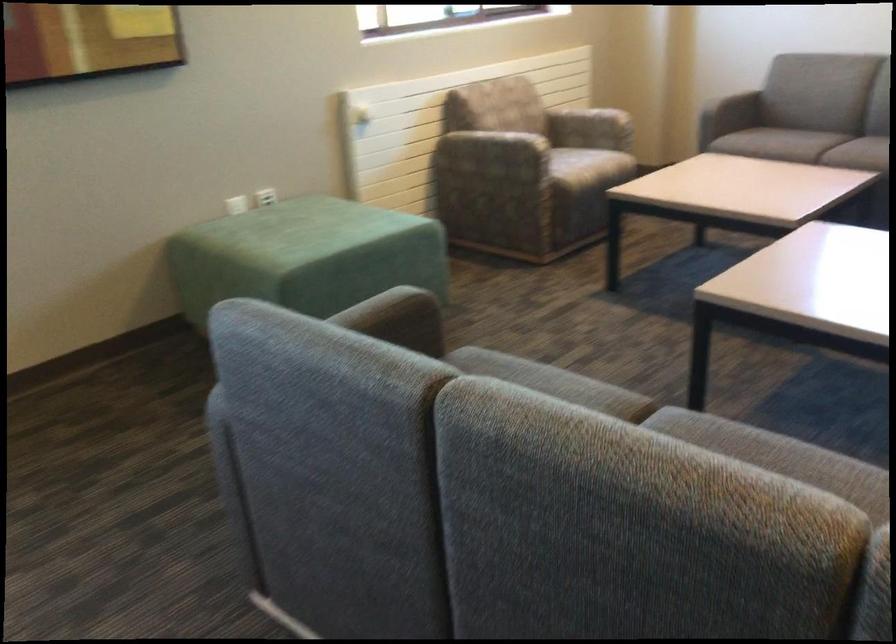
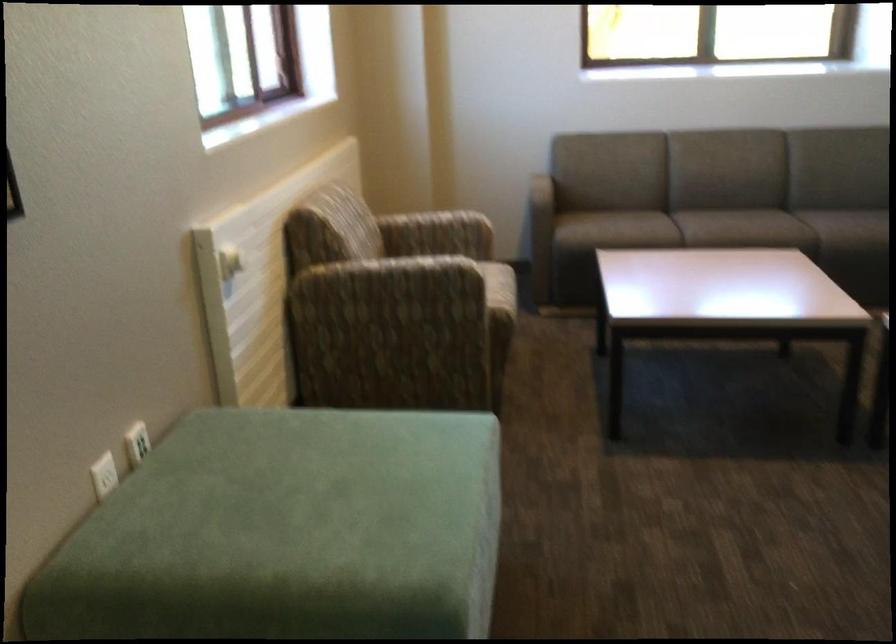
The point at (x=230, y=205) is marked in the first image. Where is the corresponding point in the second image?

(104, 475)